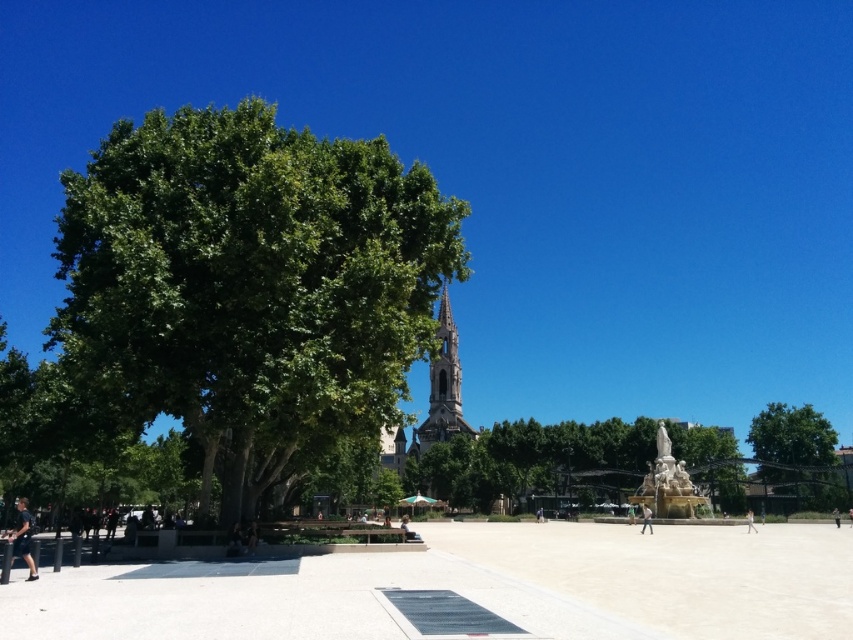
You are standing at the point marked by coordinates point (x=535, y=461) in the urban square. Looking around, you notice a large green tree to your left and a tall building with a spire in the background. Which direction should you face to see the green leafy tree at center?

You should face to your left to see the green leafy tree at center, as it is located to the left of your current position marked by point (x=535, y=461).

You are a visitor standing in the urban square and want to sit on the light brown wooden bench at center. Which direction should you walk to reach it from the green leafy tree at left?

The green leafy tree at left is positioned on the left side of the light brown wooden bench at center, so you should walk to the right to reach the bench.

You are standing at the center of the urban square and want to take a photo of the point at coordinates point (572, 476). Considering your camera has a maximum focus range of 100 meters, will you be able to capture the point clearly?

The distance of point (572, 476) from camera is 104.45 meters, which exceeds the camera maximum focus range of 100 meters. Therefore, you won not be able to capture the point clearly.